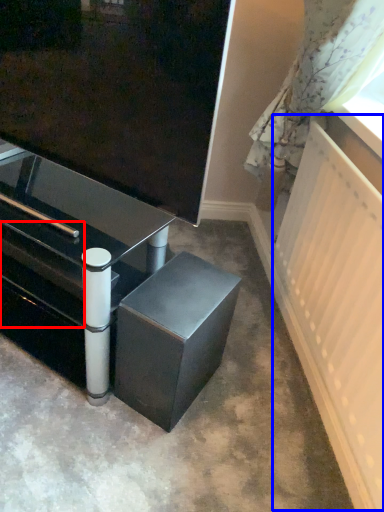
Question: Which of the following is the farthest to the observer, drawer (highlighted by a red box) or radiator (highlighted by a blue box)?

Choices:
 (A) drawer
 (B) radiator

Answer: (A)